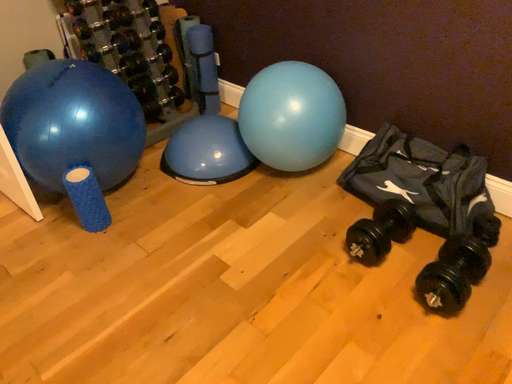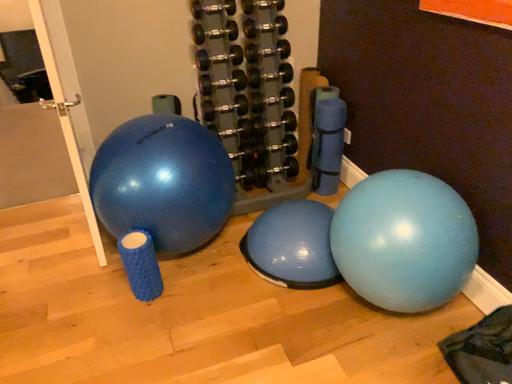
Question: How did the camera likely rotate when shooting the video?

Choices:
 (A) rotated right
 (B) rotated left

Answer: (B)